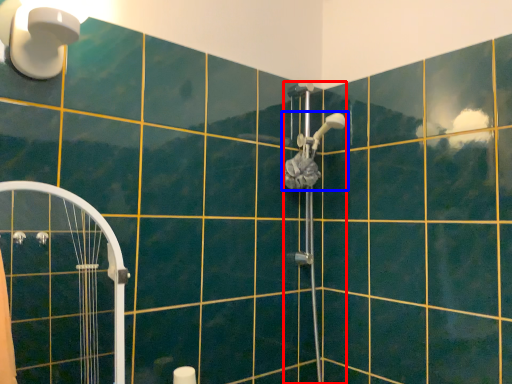
Question: Which point is further to the camera, shower (highlighted by a red box) or shower (highlighted by a blue box)?

Choices:
 (A) shower
 (B) shower

Answer: (B)